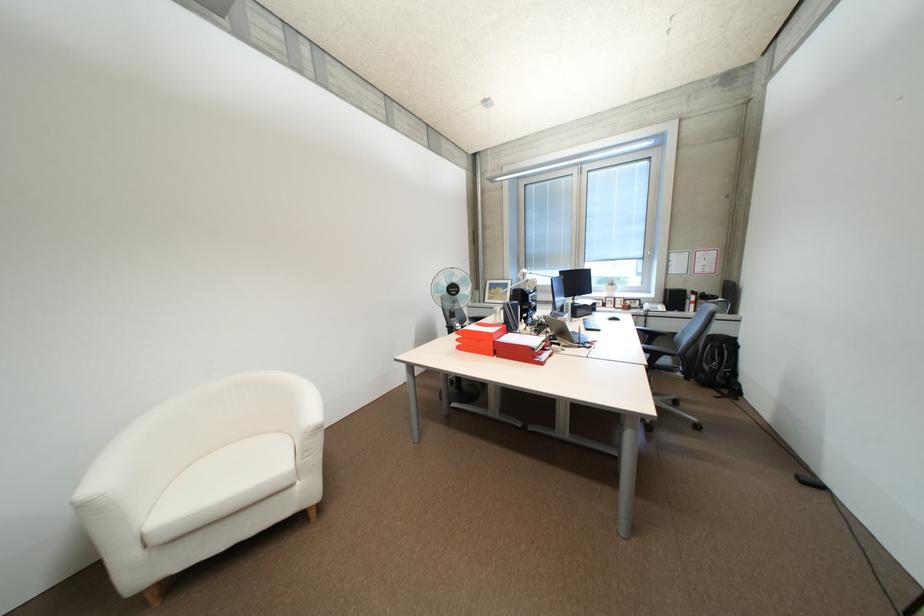
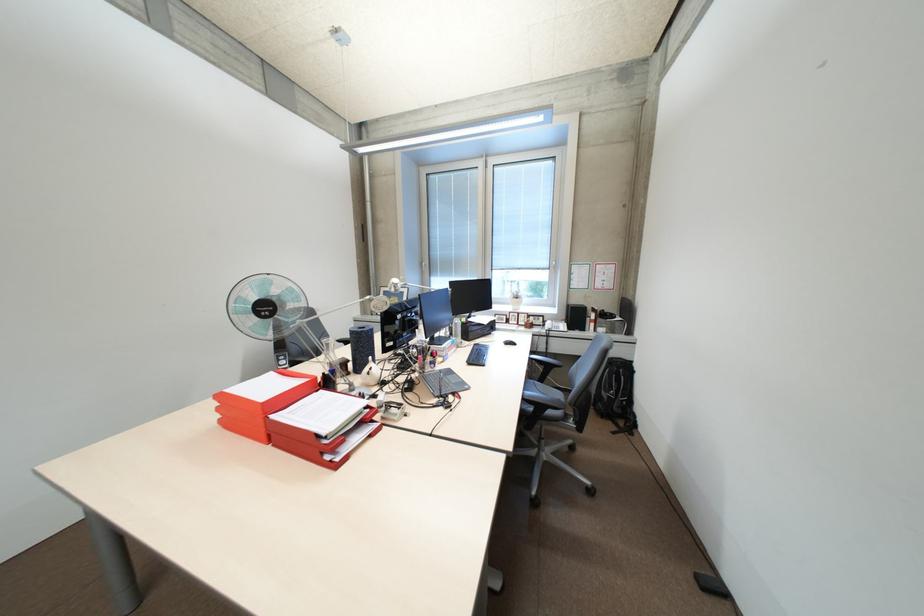
Question: I am providing you with two images of the same scene from different viewpoints. Please identify which objects are invisible in image2.

Choices:
 (A) phone handset
 (B) red paper tray
 (C) grey laptop
 (D) none of these

Answer: (D)